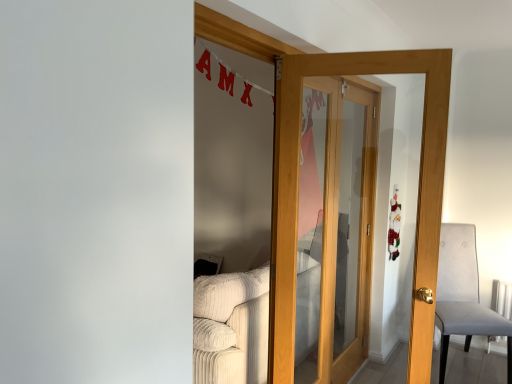
Question: Does light brown wooden door at center contain gray fabric chair at right?

Choices:
 (A) yes
 (B) no

Answer: (B)

Question: Does light brown wooden door at center appear on the left side of gray fabric chair at right?

Choices:
 (A) yes
 (B) no

Answer: (A)

Question: Is light brown wooden door at center bigger than gray fabric chair at right?

Choices:
 (A) no
 (B) yes

Answer: (A)

Question: From the image's perspective, is light brown wooden door at center beneath gray fabric chair at right?

Choices:
 (A) no
 (B) yes

Answer: (A)

Question: Is light brown wooden door at center looking in the opposite direction of gray fabric chair at right?

Choices:
 (A) yes
 (B) no

Answer: (B)

Question: Are light brown wooden door at center and gray fabric chair at right making contact?

Choices:
 (A) yes
 (B) no

Answer: (B)

Question: From a real-world perspective, is gray fabric chair at right on top of beige corduroy couch at lower left?

Choices:
 (A) no
 (B) yes

Answer: (B)

Question: Is gray fabric chair at right closer to the viewer compared to beige corduroy couch at lower left?

Choices:
 (A) no
 (B) yes

Answer: (A)

Question: Does gray fabric chair at right have a lesser width compared to beige corduroy couch at lower left?

Choices:
 (A) no
 (B) yes

Answer: (B)

Question: Does gray fabric chair at right lie behind beige corduroy couch at lower left?

Choices:
 (A) no
 (B) yes

Answer: (B)

Question: Does gray fabric chair at right turn towards beige corduroy couch at lower left?

Choices:
 (A) yes
 (B) no

Answer: (B)

Question: From a real-world perspective, is gray fabric chair at right physically below beige corduroy couch at lower left?

Choices:
 (A) yes
 (B) no

Answer: (B)

Question: Is light brown wooden door at center thinner than beige corduroy couch at lower left?

Choices:
 (A) yes
 (B) no

Answer: (A)